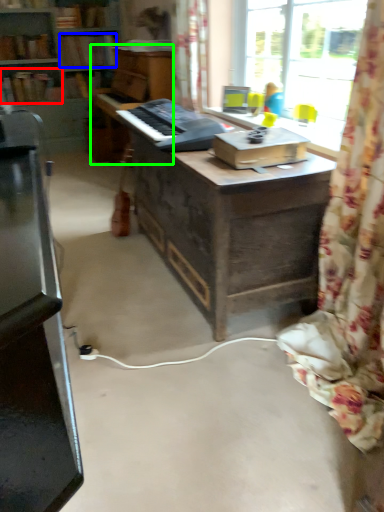
Question: Which object is positioned farthest from book (highlighted by a red box)? Select from book (highlighted by a blue box) and piano (highlighted by a green box).

Choices:
 (A) book
 (B) piano

Answer: (B)